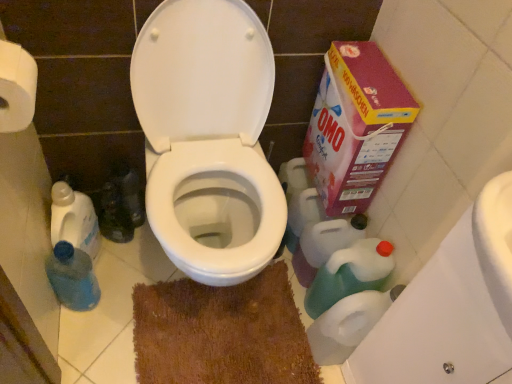
You are a GUI agent. You are given a task and a screenshot of the screen. Output one action in this format:
    pyautogui.click(x=<x>, y=<y>)
    Task: Click on the free space above brown textured bath mat at center (from a real-world perspective)
    The image size is (512, 384).
    Given the screenshot: What is the action you would take?
    pyautogui.click(x=219, y=331)